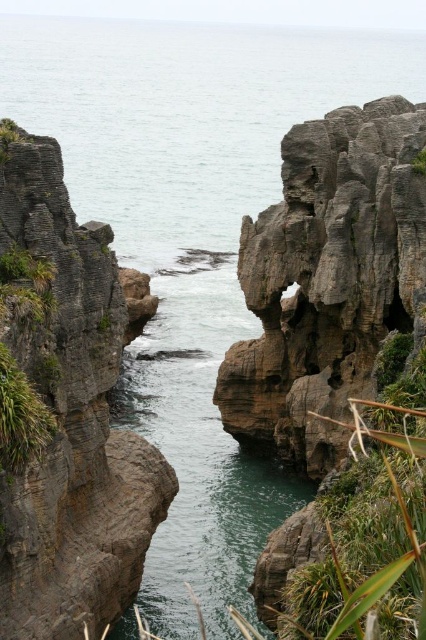
Question: Which point appears farthest from the camera in this image?

Choices:
 (A) (239, 424)
 (B) (129, 458)
 (C) (351, 580)

Answer: (A)

Question: Is the position of gray rock at center less distant than that of green leafy plant at lower right?

Choices:
 (A) no
 (B) yes

Answer: (A)

Question: Does rough gray rock at center appear over green leafy plant at lower right?

Choices:
 (A) no
 (B) yes

Answer: (B)

Question: Considering the relative positions of rough gray rock at center and green leafy plant at lower right in the image provided, where is rough gray rock at center located with respect to green leafy plant at lower right?

Choices:
 (A) left
 (B) right

Answer: (B)

Question: Which of the following is the farthest from the observer?

Choices:
 (A) (345, 483)
 (B) (26, 413)
 (C) (250, 300)

Answer: (C)

Question: Among these objects, which one is farthest from the camera?

Choices:
 (A) gray rock at center
 (B) green leafy plant at lower right
 (C) rough gray rock at center

Answer: (C)